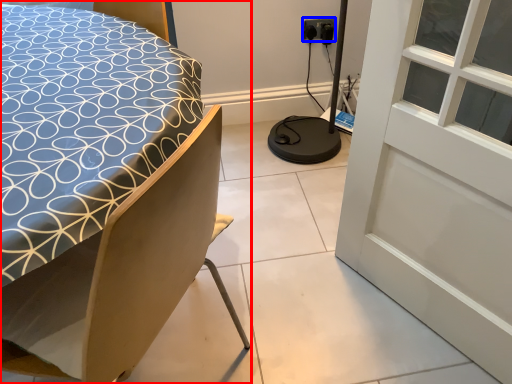
Question: Which point is further to the camera, bed (highlighted by a red box) or electric outlet (highlighted by a blue box)?

Choices:
 (A) bed
 (B) electric outlet

Answer: (B)